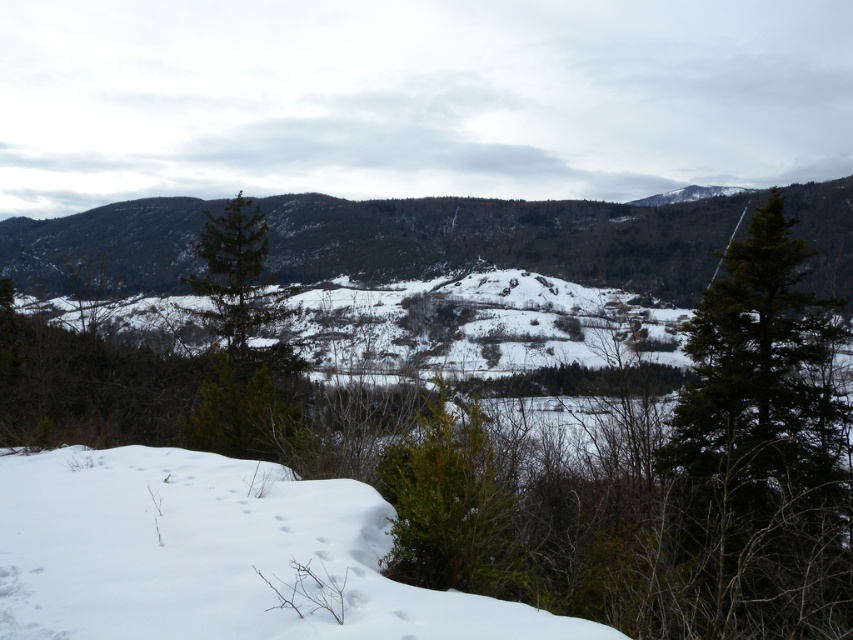
You are planning to build a snowman using the white snow at lower left and need to place it near the green matte tree at right. Is the snow accessible from the tree without having to go around any obstacles?

The white snow at lower left is positioned over the green matte tree at right, meaning the snow is directly above the tree. Since the snow is above the tree, you can access it easily by moving straight towards it from the tree without needing to go around any obstacles.